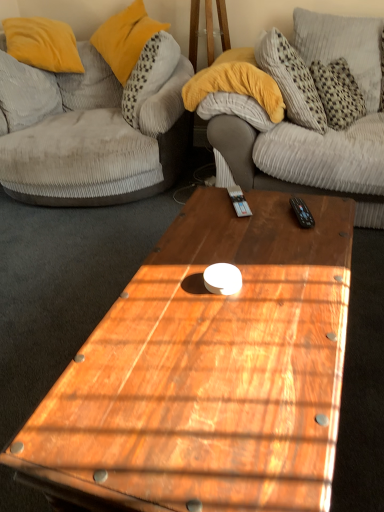
Question: Is wooden coffee table at center inside black plastic remote control at upper right?

Choices:
 (A) no
 (B) yes

Answer: (A)

Question: Considering the relative sizes of black plastic remote control at upper right and wooden coffee table at center in the image provided, is black plastic remote control at upper right shorter than wooden coffee table at center?

Choices:
 (A) yes
 (B) no

Answer: (A)

Question: Is black plastic remote control at upper right located outside wooden coffee table at center?

Choices:
 (A) no
 (B) yes

Answer: (A)

Question: Is black plastic remote control at upper right with wooden coffee table at center?

Choices:
 (A) yes
 (B) no

Answer: (B)

Question: Is black plastic remote control at upper right turned away from wooden coffee table at center?

Choices:
 (A) no
 (B) yes

Answer: (A)

Question: Is black plastic remote control at upper right bigger or smaller than wooden coffee table at center?

Choices:
 (A) small
 (B) big

Answer: (A)

Question: From a real-world perspective, is black plastic remote control at upper right positioned above or below wooden coffee table at center?

Choices:
 (A) below
 (B) above

Answer: (B)

Question: Looking at their shapes, would you say black plastic remote control at upper right is wider or thinner than wooden coffee table at center?

Choices:
 (A) thin
 (B) wide

Answer: (A)

Question: Is point (294, 205) positioned closer to the camera than point (241, 438)?

Choices:
 (A) closer
 (B) farther

Answer: (B)

Question: Do you think gray corduroy pillow at upper left, acting as the 1th pillow starting from the left, is within yellow velvet pillow at upper left, placed as the 2th pillow when sorted from left to right, or outside of it?

Choices:
 (A) inside
 (B) outside

Answer: (B)

Question: Visually, is gray corduroy pillow at upper left, acting as the 1th pillow starting from the left, positioned to the left or to the right of yellow velvet pillow at upper left, the 2th pillow when ordered from right to left?

Choices:
 (A) left
 (B) right

Answer: (A)

Question: From a real-world perspective, is gray corduroy pillow at upper left, acting as the 1th pillow starting from the left, above or below yellow velvet pillow at upper left, the 2th pillow when ordered from right to left?

Choices:
 (A) above
 (B) below

Answer: (B)

Question: In terms of width, does gray corduroy pillow at upper left, which is counted as the third pillow, starting from the right, look wider or thinner when compared to yellow velvet pillow at upper left, the 2th pillow when ordered from right to left?

Choices:
 (A) thin
 (B) wide

Answer: (A)

Question: Is point (168, 139) positioned closer to the camera than point (291, 197)?

Choices:
 (A) closer
 (B) farther

Answer: (B)

Question: Considering the positions of velvet grey couch at left and black plastic remote control at upper right in the image, is velvet grey couch at left taller or shorter than black plastic remote control at upper right?

Choices:
 (A) tall
 (B) short

Answer: (A)